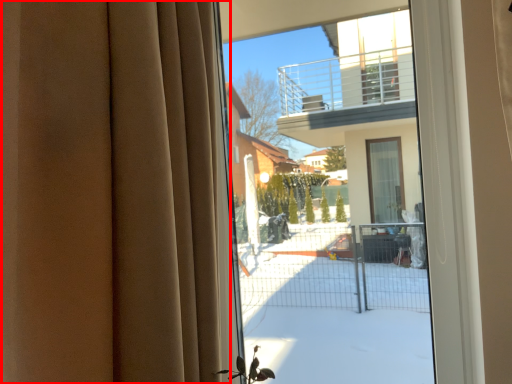
Question: Where is curtain (annotated by the red box) located in relation to bay window in the image?

Choices:
 (A) right
 (B) left

Answer: (B)